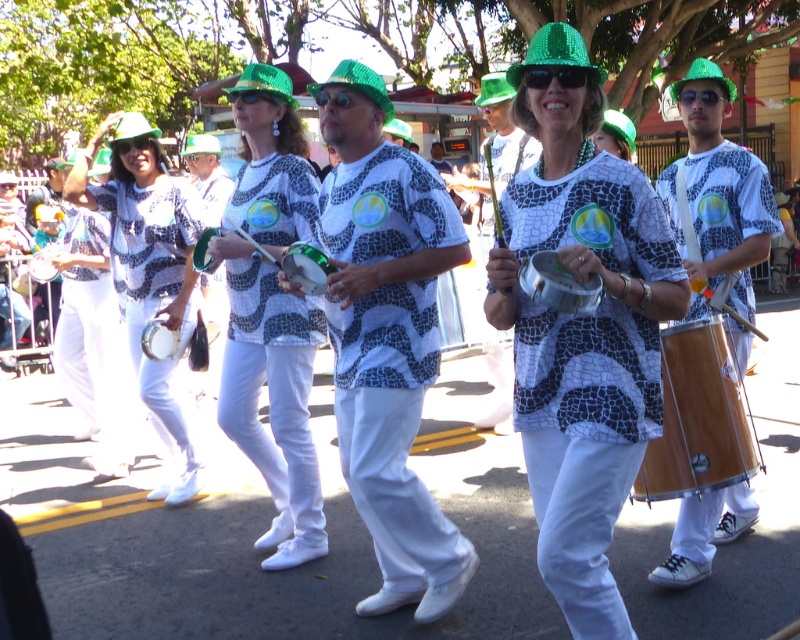
Question: Which point is farther from the camera taking this photo?

Choices:
 (A) (668, 573)
 (B) (554, 72)
 (C) (441, 595)

Answer: (A)

Question: Does matte black shirt at center appear on the right side of black plastic sunglasses at center?

Choices:
 (A) yes
 (B) no

Answer: (B)

Question: Does matte black shirt at center appear under shiny silver drum at center?

Choices:
 (A) no
 (B) yes

Answer: (A)

Question: Does shiny green hat at center appear on the right side of matte black shirt at center?

Choices:
 (A) no
 (B) yes

Answer: (B)

Question: Which point appears closest to the camera in this image?

Choices:
 (A) (564, 452)
 (B) (733, 294)
 (C) (548, 70)

Answer: (C)

Question: Which object is closer to the camera taking this photo?

Choices:
 (A) matte white drum at center
 (B) matte white pants at left
 (C) wooden drum at center

Answer: (C)